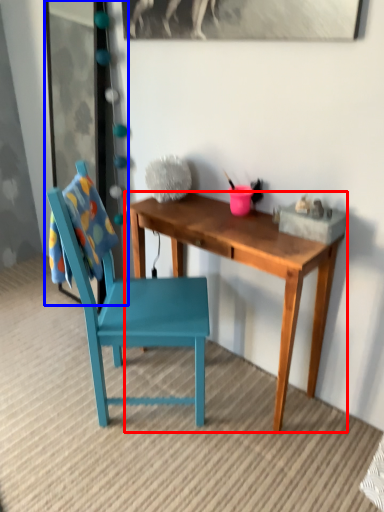
Question: Which of the following is the farthest to the observer, desk (highlighted by a red box) or glass door (highlighted by a blue box)?

Choices:
 (A) desk
 (B) glass door

Answer: (B)